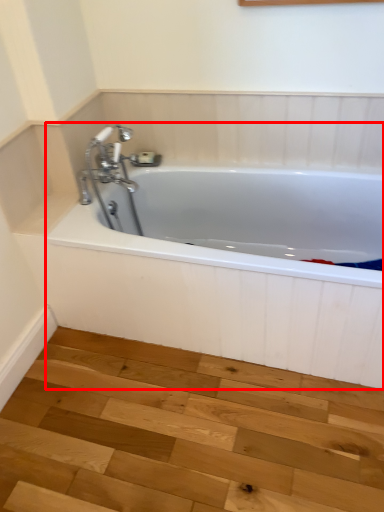
Question: From the image, what is the correct spatial relationship of bathtub (annotated by the red box) in relation to stair?

Choices:
 (A) right
 (B) left

Answer: (A)